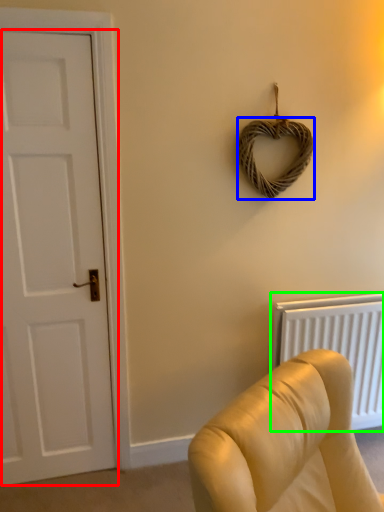
Question: Based on their relative distances, which object is nearer to door (highlighted by a red box)? Choose from rope (highlighted by a blue box) and radiator (highlighted by a green box).

Choices:
 (A) rope
 (B) radiator

Answer: (A)